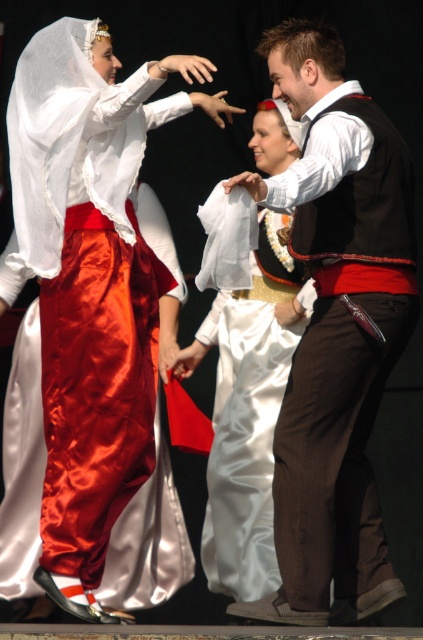
Question: Can you confirm if matte brown vest at center is smaller than satin/velvet dress at left?

Choices:
 (A) yes
 (B) no

Answer: (A)

Question: Is matte brown vest at center further to the viewer compared to satin white dress at center?

Choices:
 (A) no
 (B) yes

Answer: (A)

Question: Observing the image, what is the correct spatial positioning of matte brown vest at center in reference to satin/velvet dress at left?

Choices:
 (A) below
 (B) above

Answer: (B)

Question: Which of the following is the farthest from the observer?

Choices:
 (A) (18, 504)
 (B) (280, 214)
 (C) (337, 380)

Answer: (B)

Question: Estimate the real-world distances between objects in this image. Which object is closer to the satin/velvet dress at left?

Choices:
 (A) matte brown vest at center
 (B) satin white dress at center

Answer: (B)

Question: Estimate the real-world distances between objects in this image. Which object is farther from the satin/velvet dress at left?

Choices:
 (A) matte brown vest at center
 (B) satin white dress at center

Answer: (A)